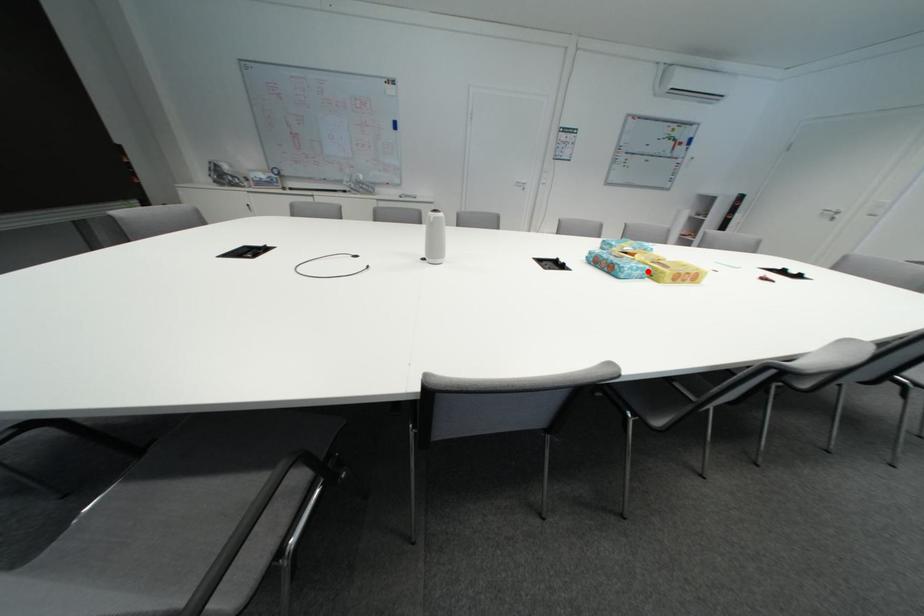
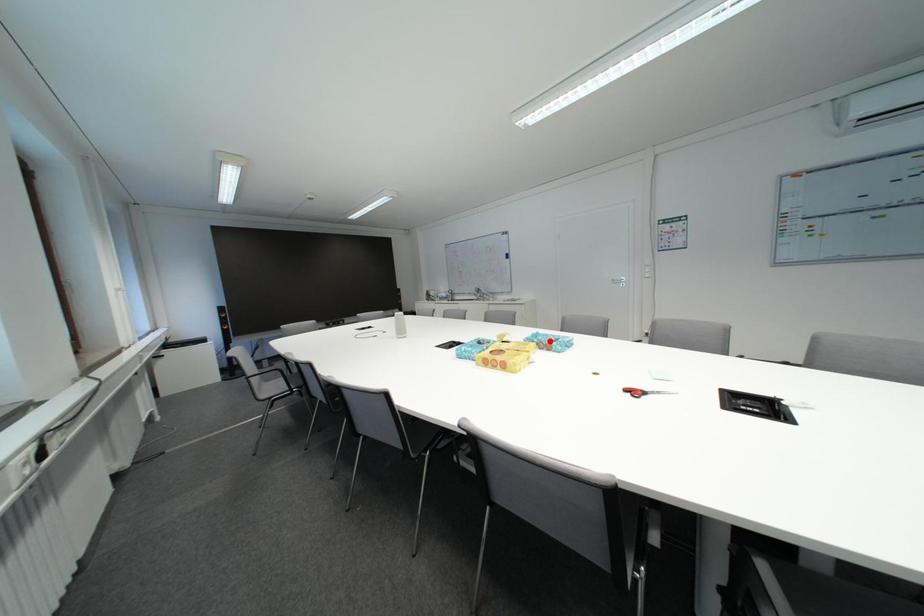
I am providing you with two images of the same scene from different viewpoints. A red point is marked on the first image and another point is marked on the second image. Does the point marked in image1 correspond to the same location as the one in image2?

No